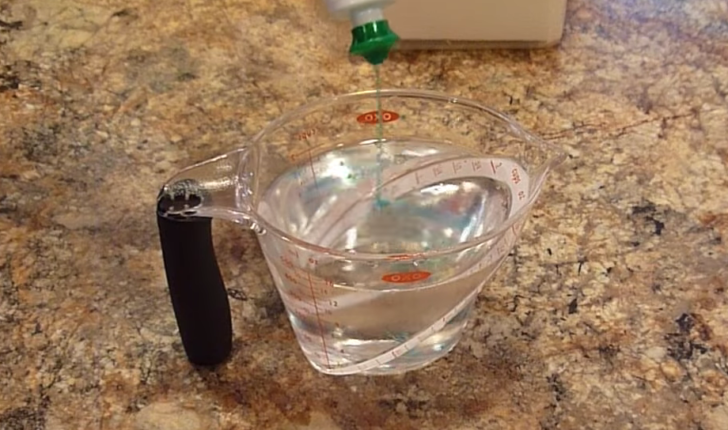
Where is `top of handle`? top of handle is located at coordinates (232, 186).